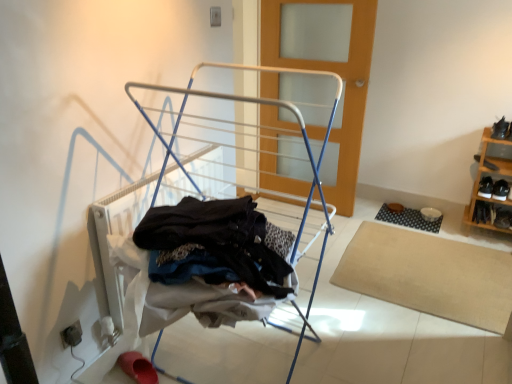
Locate an element on the screen. The width and height of the screenshot is (512, 384). free space between beige carpet at lower right, which appears as the 2th mat when viewed from the back, and black rubber mat at lower right, which is counted as the 1th mat, starting from the back is located at coordinates (437, 226).